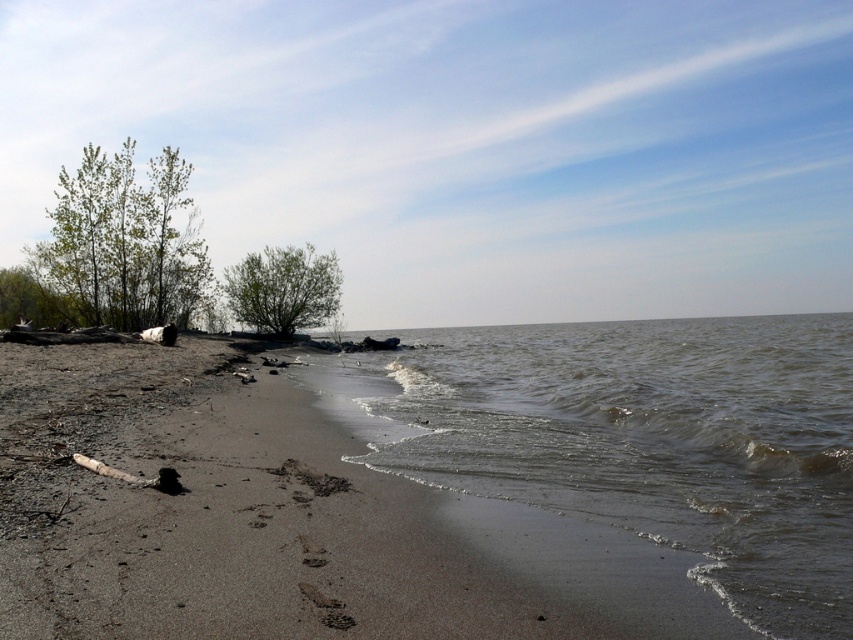
You are standing on the beach and want to walk to the water. You see the brown murky water at lower left and the green matte tree at center. Which direction should you go to reach the water first?

The brown murky water at lower left is below the green matte tree at center, so you should go towards the lower left direction to reach the water first.

You are standing on the beach and see the brown murky water at lower left and the green leafy trees at upper left. Which object is positioned lower in the scene?

The brown murky water at lower left is positioned below the green leafy trees at upper left, so it is lower in the scene.

You are standing at the center of the beach and want to avoid the brown murky water at lower left. Which direction should you move to stay away from it?

The brown murky water at lower left is located at point (645, 440), so you should move towards the upper right direction to stay away from it.